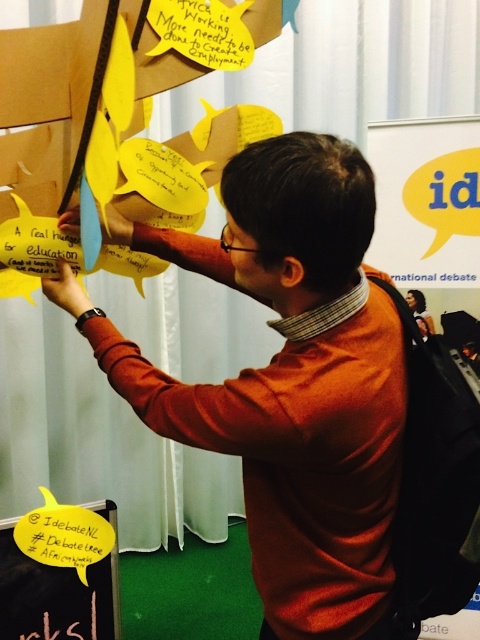
You are a photographer at the International Debate event. You need to position a spotlight exactly at point [289,381]. Where should you aim the spotlight?

The point [289,381] corresponds to the orange sweater at center, so you should aim the spotlight at the orange sweater at center.

You are organizing a photo shoot and need to position a model wearing an orange sweater at center and a yellow paper at upper left. According to the scene, which object is positioned to the right of the other?

The orange sweater at center is to the right of yellow paper at upper left.